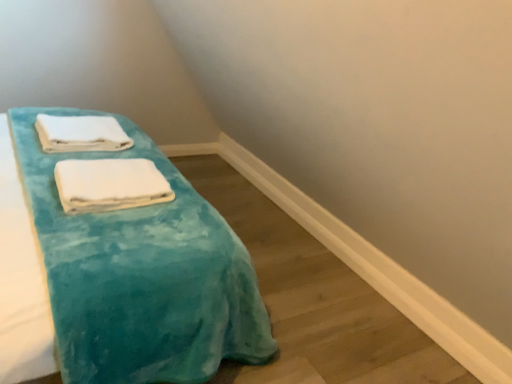
Question: Is point (65, 236) closer or farther from the camera than point (73, 134)?

Choices:
 (A) farther
 (B) closer

Answer: (B)

Question: Would you say turquoise soft towel at center is to the left or to the right of white soft towel at upper left, marked as the first towel in a top-to-bottom arrangement, in the picture?

Choices:
 (A) left
 (B) right

Answer: (B)

Question: Based on their relative distances, which object is farther from the white soft towel at upper left, which is the 2th towel from front to back?

Choices:
 (A) turquoise soft towel at center
 (B) white soft towel at center, which is the second towel in top-to-bottom order

Answer: (A)

Question: Estimate the real-world distances between objects in this image. Which object is closer to the turquoise soft towel at center?

Choices:
 (A) white soft towel at upper left, marked as the first towel in a top-to-bottom arrangement
 (B) white soft towel at center, marked as the 1th towel in a front-to-back arrangement

Answer: (B)